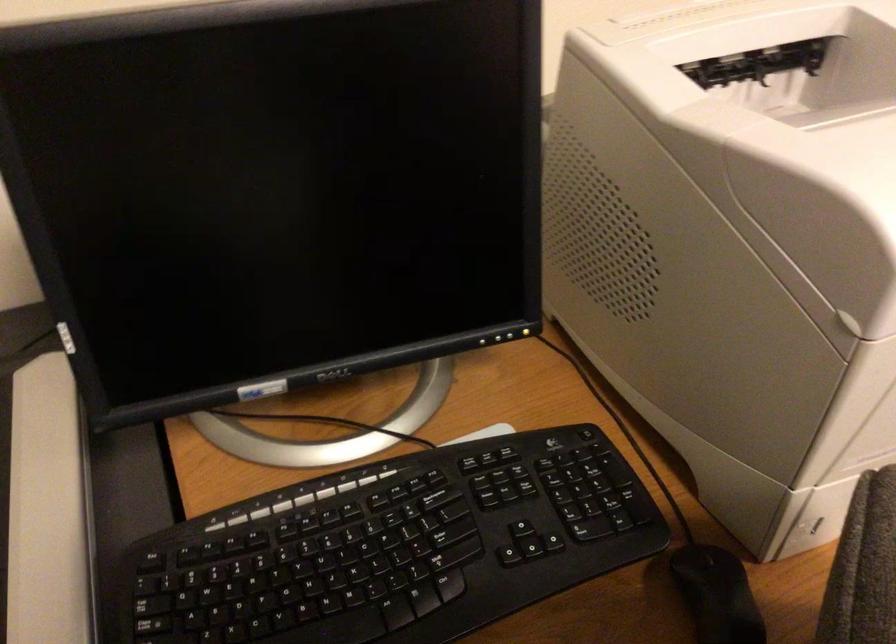
Locate an element on the screen. This screenshot has height=644, width=896. printer top cover is located at coordinates (616, 21).